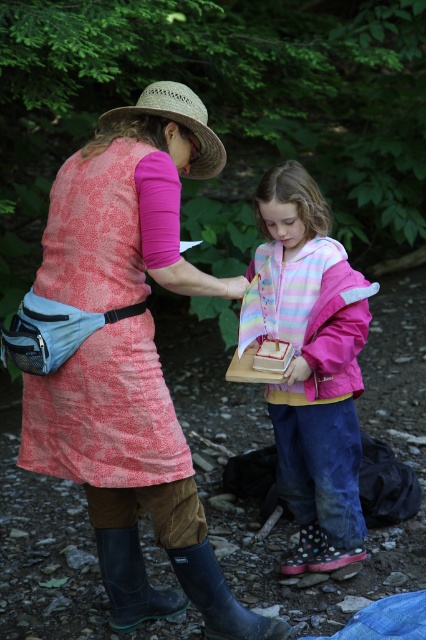
You are a hiker who needs to decide which item is closer to the right edge of the path. You see the pink fabric jacket at center and the rubber boots at lower center. Which one is more to the right?

The pink fabric jacket at center is positioned on the right side of rubber boots at lower center, so the pink fabric jacket at center is more to the right.

You are standing at the origin point in the forest scene. The rubber boots at lower center are positioned at coordinates point0.934, 0.514. If you need to place a marker exactly at their location, where should you place it?

The rubber boots at lower center are located at point0.(x=218, y=639), so you should place the marker at those coordinates.

You are a photographer trying to capture a clear shot of both the pink fabric jacket at center and the rubber boots at lower center. Which object should you focus on first to ensure it appears sharp in the photo?

The pink fabric jacket at center is further to the viewer than the rubber boots at lower center, so you should focus on the pink fabric jacket at center first to ensure both are in focus.